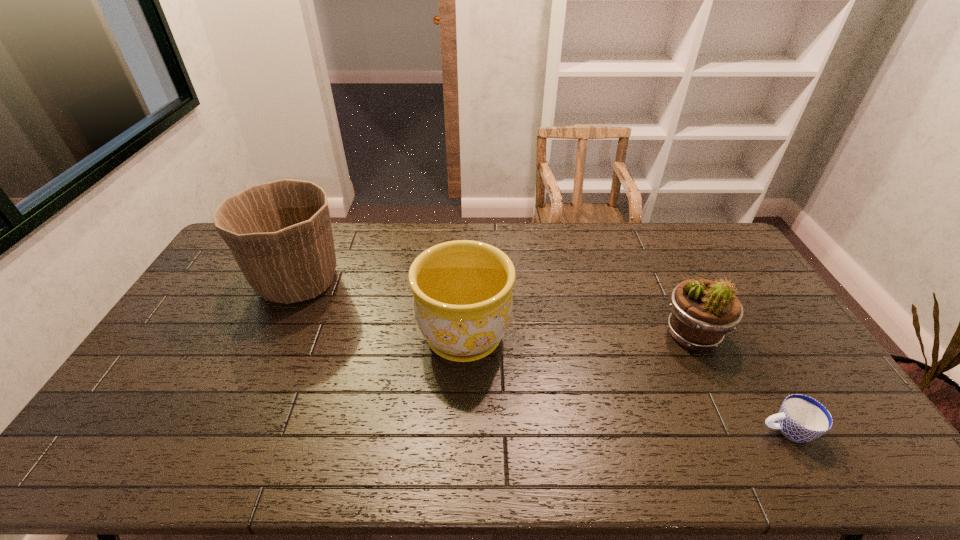
In the image, there is a desktop. Where is `blank space at the left edge`? The width and height of the screenshot is (960, 540). blank space at the left edge is located at coordinates (240, 290).

In the image, there is a desktop. Where is `vacant space at the right edge`? vacant space at the right edge is located at coordinates (817, 368).

Identify the location of vacant space that's between the cup and the rightmost flowerpot. (739, 382).

Identify the location of free space that is in between the cup and the rightmost flowerpot. (739, 382).

You are a GUI agent. You are given a task and a screenshot of the screen. Output one action in this format:
    pyautogui.click(x=<x>, y=<y>)
    Task: Click on the free space between the second flowerpot from right to left and the tallest flowerpot
    
    Given the screenshot: What is the action you would take?
    pyautogui.click(x=381, y=309)

The height and width of the screenshot is (540, 960). In order to click on vacant area that lies between the third object from right to left and the tallest flowerpot in this screenshot , I will do `click(381, 309)`.

Where is `unoccupied position between the third object from right to left and the shortest object`? The image size is (960, 540). unoccupied position between the third object from right to left and the shortest object is located at coordinates (625, 383).

This screenshot has width=960, height=540. Identify the location of empty space that is in between the leftmost flowerpot and the shortest object. (542, 356).

You are a GUI agent. You are given a task and a screenshot of the screen. Output one action in this format:
    pyautogui.click(x=<x>, y=<y>)
    Task: Click on the blank region between the nearest object and the second flowerpot from left to right
    
    Given the screenshot: What is the action you would take?
    pyautogui.click(x=625, y=383)

Where is `object that stands as the third closest to the tallest object`? object that stands as the third closest to the tallest object is located at coordinates (801, 418).